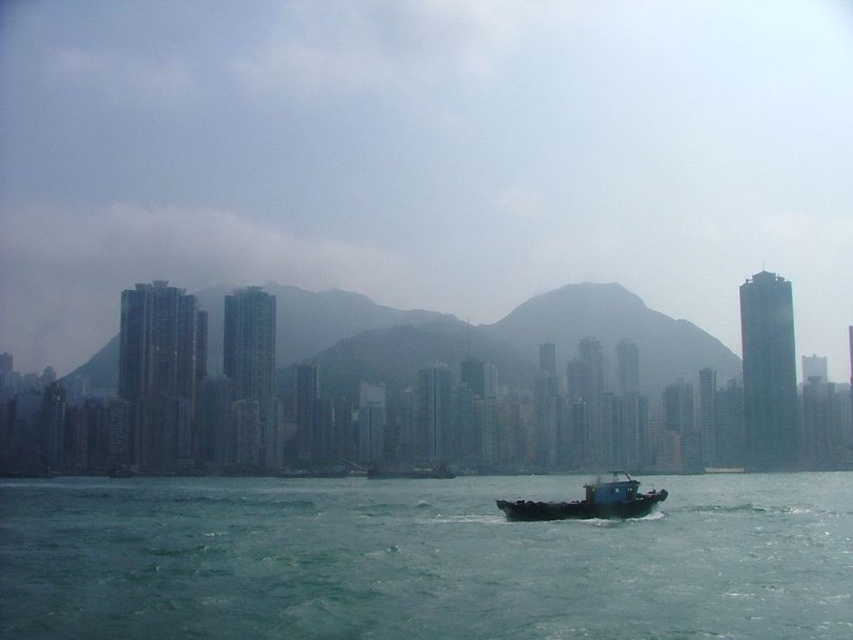
Is greenish-blue water at center smaller than blue matte boat at center?

No, greenish-blue water at center is not smaller than blue matte boat at center.

Locate an element on the screen. This screenshot has width=853, height=640. greenish-blue water at center is located at coordinates (421, 561).

This screenshot has width=853, height=640. Find the location of `greenish-blue water at center`. greenish-blue water at center is located at coordinates (421, 561).